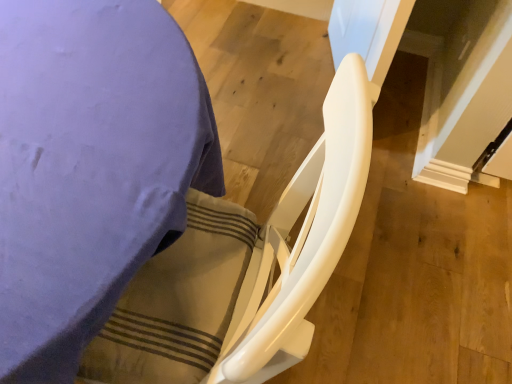
Question: Do you think white glossy chair at lower right is within white glossy rocking chair at center, or outside of it?

Choices:
 (A) outside
 (B) inside

Answer: (A)

Question: Visually, is white glossy chair at lower right positioned to the left or to the right of white glossy rocking chair at center?

Choices:
 (A) right
 (B) left

Answer: (B)

Question: Is point (47, 157) positioned closer to the camera than point (331, 215)?

Choices:
 (A) closer
 (B) farther

Answer: (B)

Question: Is white glossy rocking chair at center to the left or to the right of white glossy chair at lower right in the image?

Choices:
 (A) left
 (B) right

Answer: (B)

Question: From the image's perspective, is white glossy rocking chair at center located above or below white glossy chair at lower right?

Choices:
 (A) above
 (B) below

Answer: (B)

Question: Based on their sizes in the image, would you say white glossy rocking chair at center is bigger or smaller than white glossy chair at lower right?

Choices:
 (A) big
 (B) small

Answer: (B)

Question: From a real-world perspective, relative to white glossy chair at lower right, is white glossy rocking chair at center vertically above or below?

Choices:
 (A) below
 (B) above

Answer: (B)